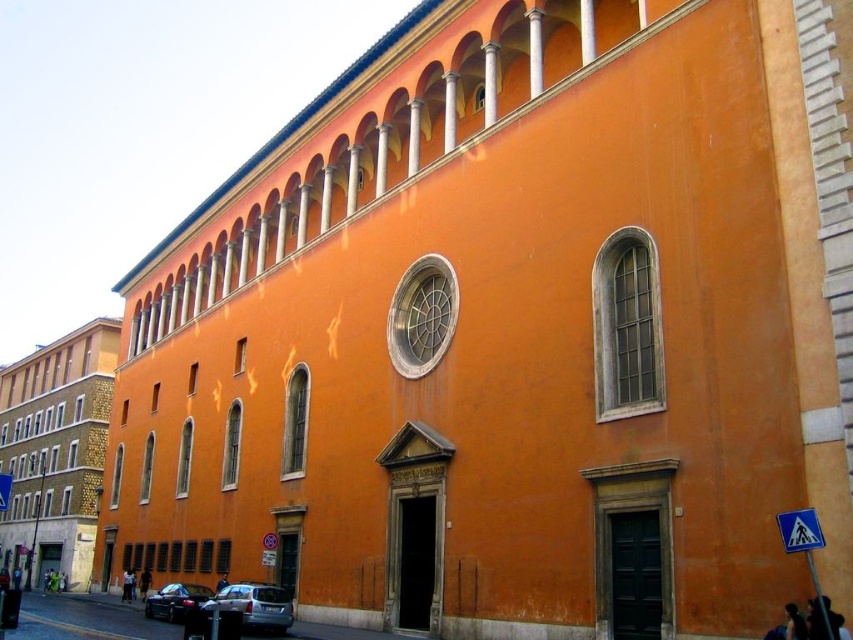
Is shiny black car at lower left wider than black leather bag at lower left?

Correct, the width of shiny black car at lower left exceeds that of black leather bag at lower left.

Is shiny black car at lower left further to camera compared to black leather bag at lower left?

No, shiny black car at lower left is closer to the viewer.

Describe the element at coordinates (175, 600) in the screenshot. I see `shiny black car at lower left` at that location.

At what (x,y) coordinates should I click in order to perform the action: click on shiny black car at lower left. Please return your answer as a coordinate pair (x, y). Looking at the image, I should click on (175, 600).

Which of these two, dark blue fabric at lower right or dark blue fabric at lower left, stands shorter?

With less height is dark blue fabric at lower right.

Is the position of dark blue fabric at lower right more distant than that of dark blue fabric at lower left?

No.

The height and width of the screenshot is (640, 853). In order to click on dark blue fabric at lower right in this screenshot , I will do `click(815, 620)`.

Does silver metallic car at lower left appear over dark blue fabric at lower right?

Actually, silver metallic car at lower left is below dark blue fabric at lower right.

Is point (241, 602) less distant than point (811, 621)?

No, (241, 602) is behind (811, 621).

Between point (256, 592) and point (817, 600), which one is positioned in front?

Point (817, 600) is in front.

Identify the location of silver metallic car at lower left. This screenshot has height=640, width=853. (254, 605).